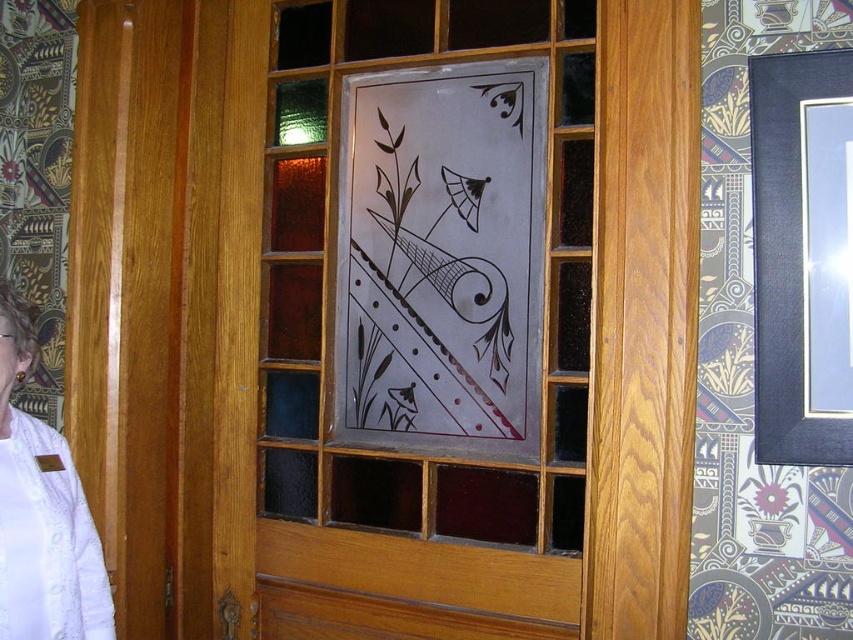
Question: Is transparent glass artwork at center to the right of white fabric at left from the viewer's perspective?

Choices:
 (A) no
 (B) yes

Answer: (B)

Question: Does transparent glass door at center come behind white fabric at left?

Choices:
 (A) yes
 (B) no

Answer: (A)

Question: Can you confirm if transparent glass door at center is positioned below transparent glass artwork at center?

Choices:
 (A) yes
 (B) no

Answer: (A)

Question: Among these objects, which one is nearest to the camera?

Choices:
 (A) transparent glass door at center
 (B) transparent glass artwork at center
 (C) white fabric at left

Answer: (C)

Question: Which point is farther to the camera?

Choices:
 (A) white fabric at left
 (B) transparent glass door at center
 (C) transparent glass artwork at center

Answer: (C)

Question: Which point appears closest to the camera in this image?

Choices:
 (A) (404, 32)
 (B) (521, 362)

Answer: (B)